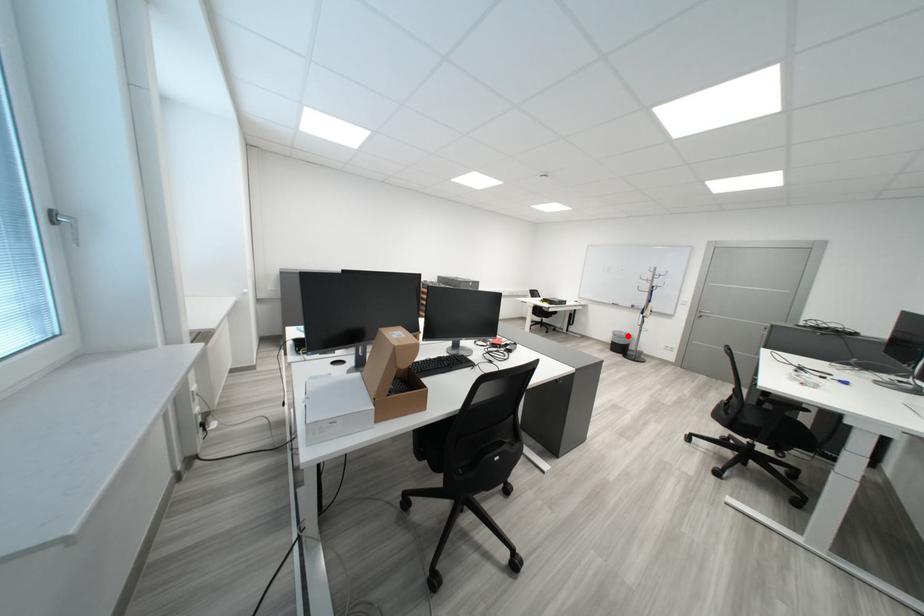
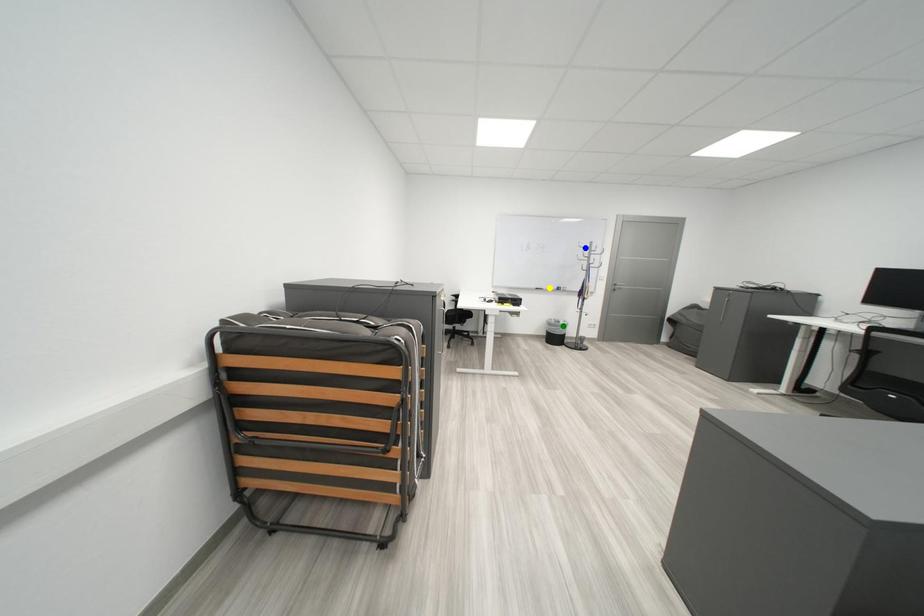
Question: I am providing you with two images of the same scene from different viewpoints. A red point is marked on the first image. You are given multiple points on the second image. Which point in image 2 is actually the same real-world point as the red point in image 1?

Choices:
 (A) yellow point
 (B) blue point
 (C) green point

Answer: (C)